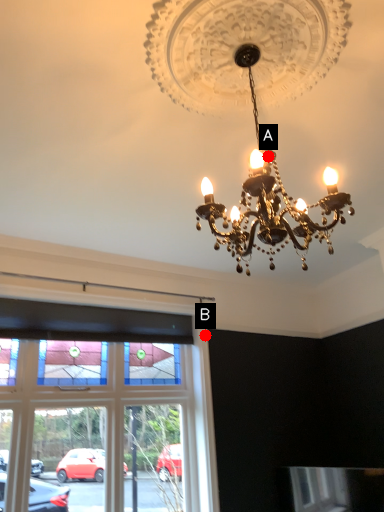
Question: Two points are circled on the image, labeled by A and B beside each circle. Which point is closer to the camera?

Choices:
 (A) A is closer
 (B) B is closer

Answer: (A)